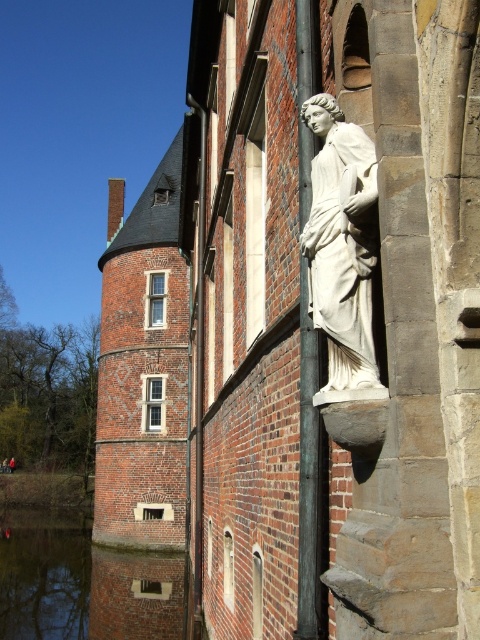
From the picture: Who is lower down, white marble statue at upper right or smooth gray pole at center?

Positioned lower is smooth gray pole at center.

Which is in front, point (345, 257) or point (307, 276)?

Point (345, 257) is more forward.

At what (x,y) coordinates should I click in order to perform the action: click on white marble statue at upper right. Please return your answer as a coordinate pair (x, y). Image resolution: width=480 pixels, height=640 pixels. Looking at the image, I should click on (342, 244).

You are a GUI agent. You are given a task and a screenshot of the screen. Output one action in this format:
    pyautogui.click(x=<x>, y=<y>)
    Task: Click on the white marble statue at upper right
    Image resolution: width=480 pixels, height=640 pixels.
    Given the screenshot: What is the action you would take?
    pyautogui.click(x=342, y=244)